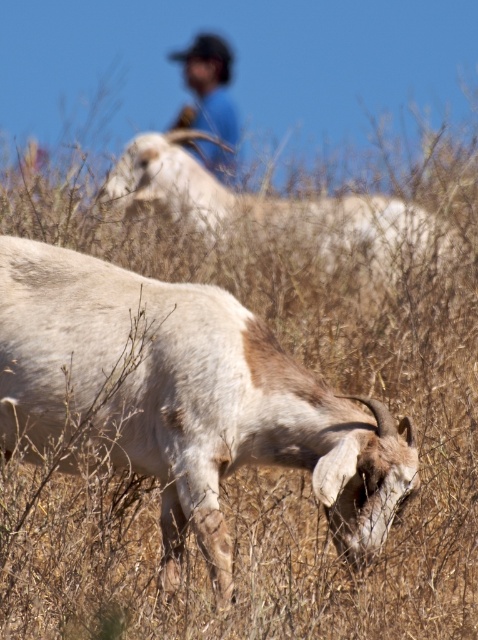
From the picture: You are a photographer standing in the field. You want to take a photo of the white woolen goat at lower center and the blue cotton shirt at upper center. Which object should you adjust your camera to focus on first if you want to capture both clearly in the same frame?

The white woolen goat at lower center is to the right of the blue cotton shirt at upper center, so you should focus on the blue cotton shirt at upper center first to ensure both are in focus since it is closer to the camera.

You are a photographer standing in the field and want to take a photo of the white woolen goat at upper center and the blue cotton shirt at upper center. Which object should you focus on first to ensure both are in focus?

You should focus on the white woolen goat at upper center first because it is closer to the viewer than the blue cotton shirt at upper center, so adjusting focus from near to far will help both be in focus.

You are standing in the field and see the white woolen goat at lower center and the white woolen goat at upper center. Which goat is closer to you?

The white woolen goat at lower center is closer to you because it is positioned below the white woolen goat at upper center, indicating it is in a lower, nearer position.